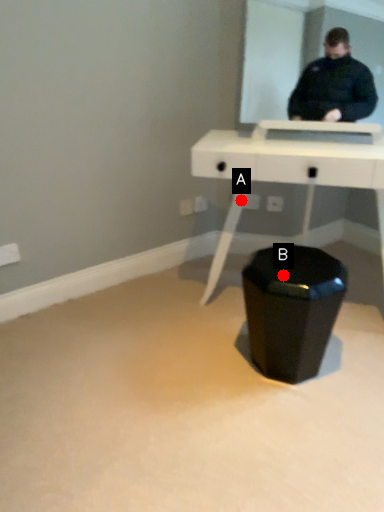
Question: Two points are circled on the image, labeled by A and B beside each circle. Which of the following is the closest to the observer?

Choices:
 (A) A is closer
 (B) B is closer

Answer: (B)